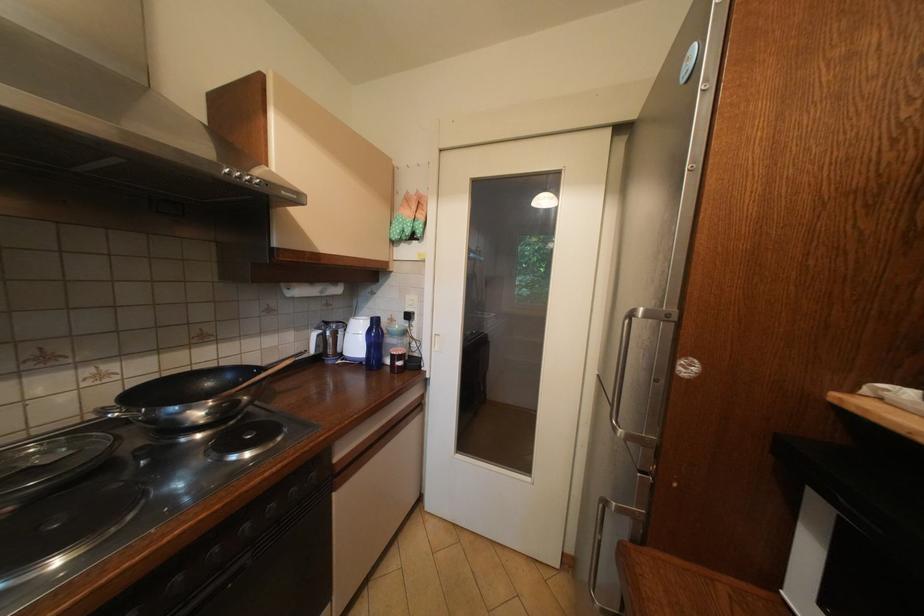
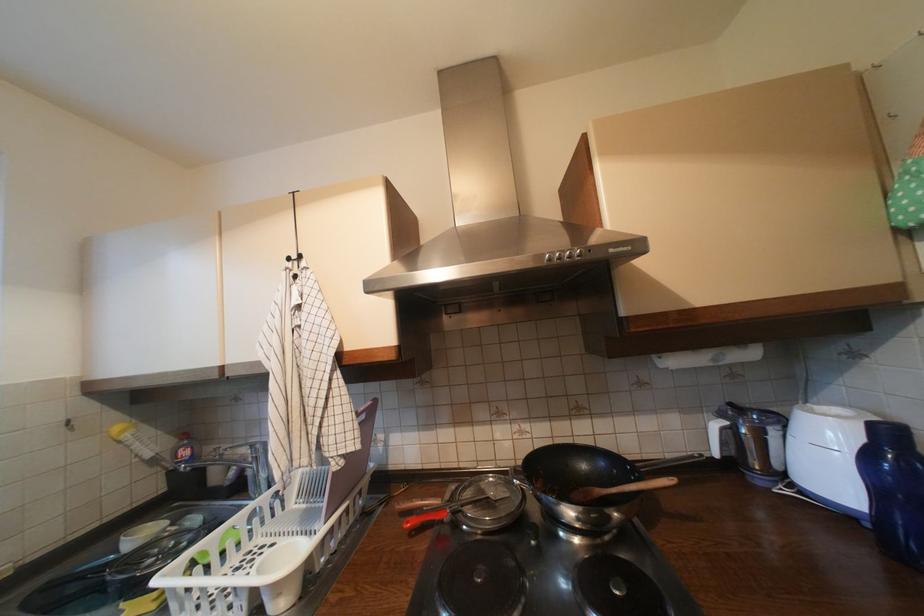
Find the pixel in the second image that matches the point at 346,334 in the first image.

(774, 435)